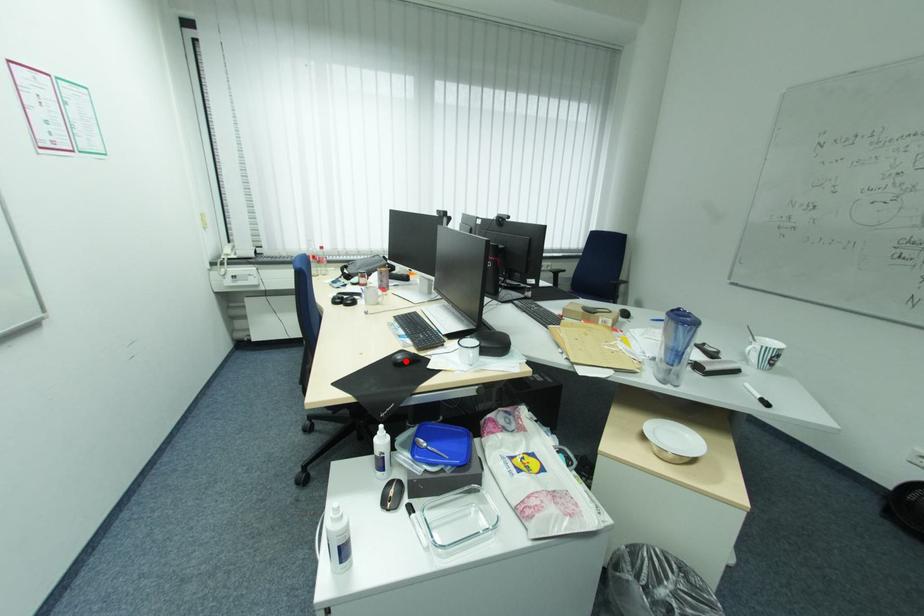
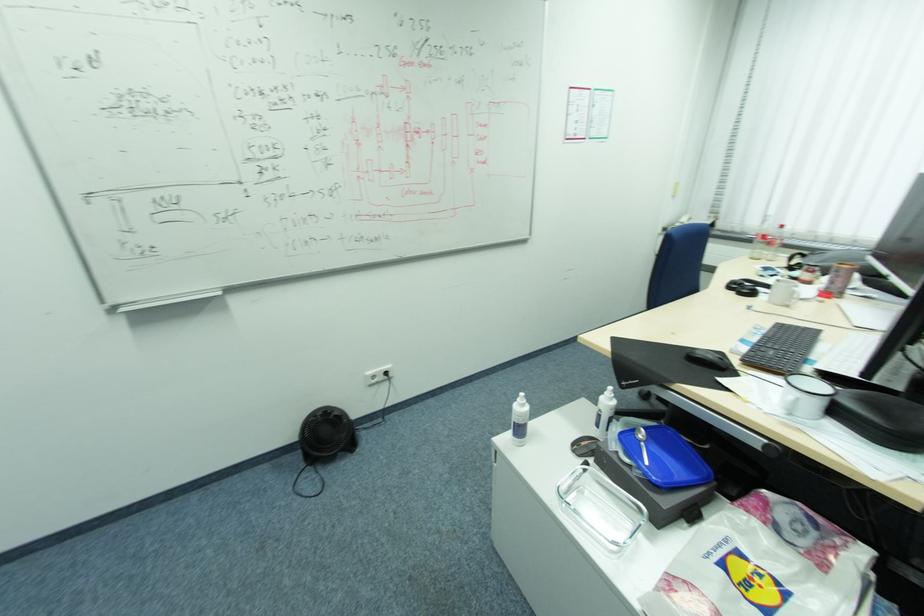
Where in the second image is the point corresponding to the highlighted location from the first image?

(699, 355)